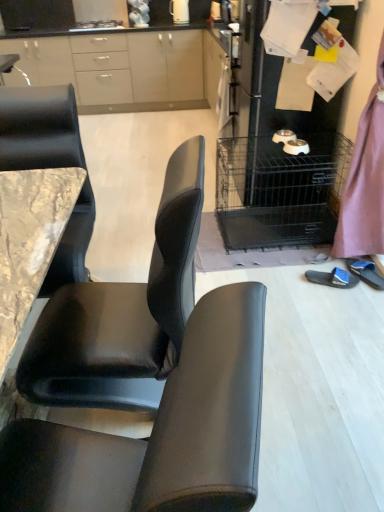
This screenshot has width=384, height=512. In order to click on free spot above blue fabric slipper at lower right, which is the first footwear from right to left (from a real-world perspective) in this screenshot , I will do `click(366, 263)`.